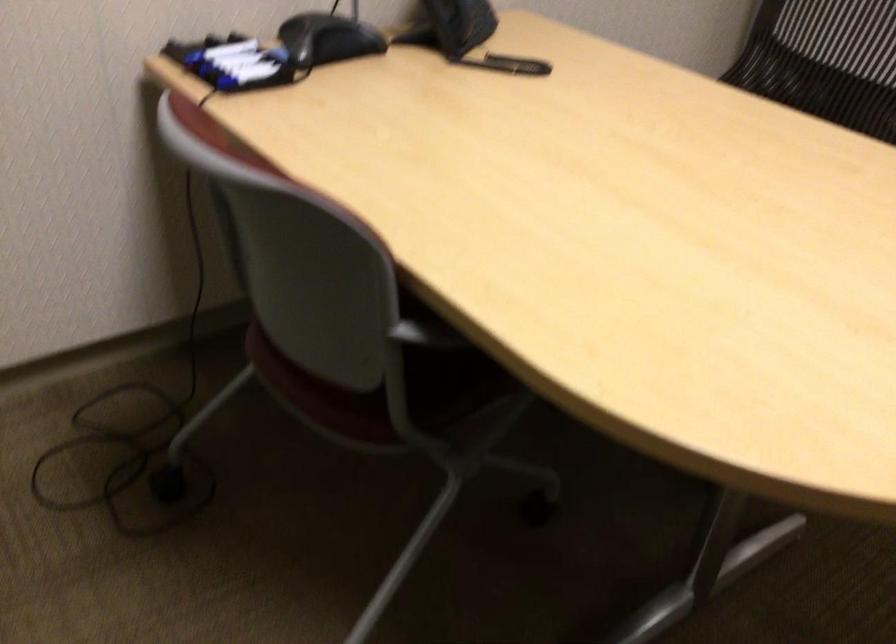
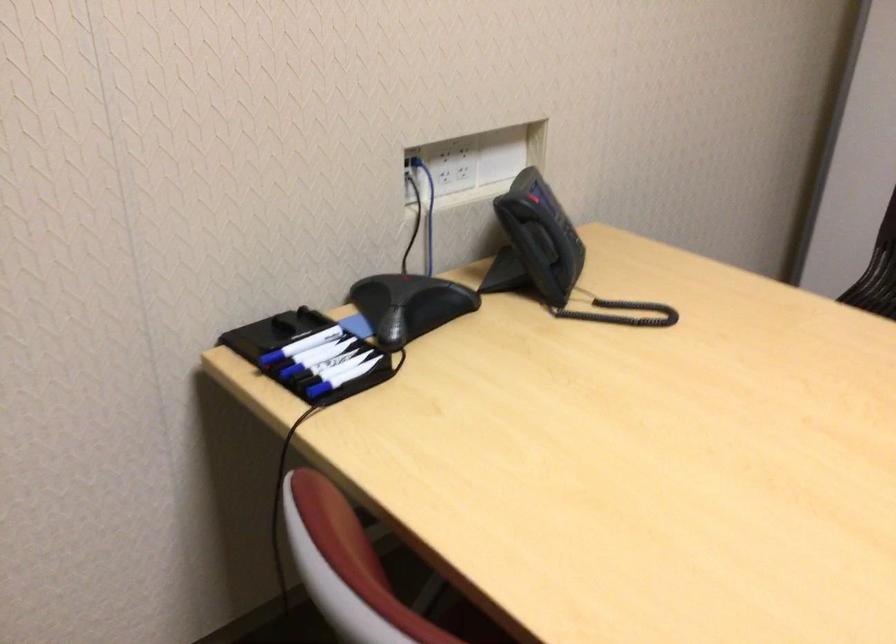
The point at (254, 67) is marked in the first image. Where is the corresponding point in the second image?

(342, 363)